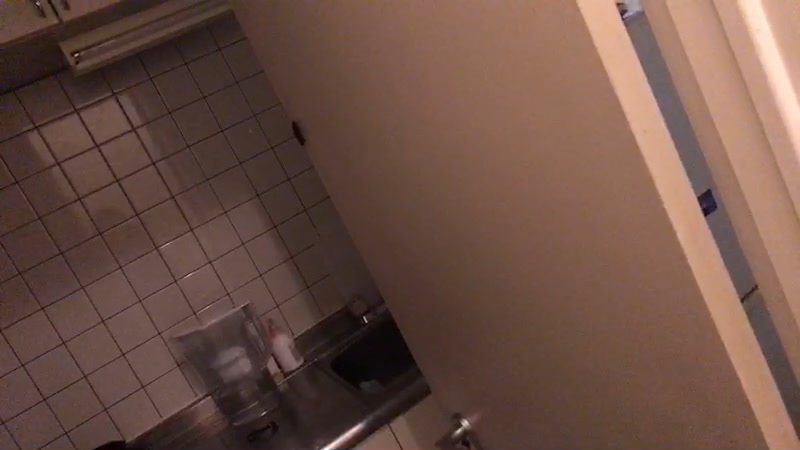
Find the location of a particular element. The height and width of the screenshot is (450, 800). door is located at coordinates (482, 214).